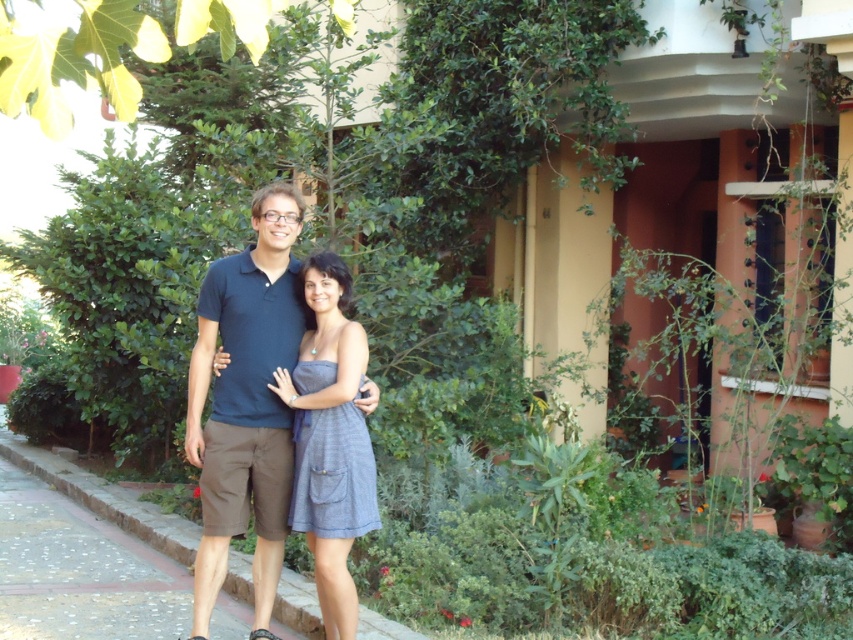
Question: Is dark blue cotton shirt at center to the left of gray woven dress at center from the viewer's perspective?

Choices:
 (A) no
 (B) yes

Answer: (B)

Question: Is dark blue cotton shirt at center above gray woven dress at center?

Choices:
 (A) no
 (B) yes

Answer: (B)

Question: Is dark blue cotton shirt at center wider than gray woven dress at center?

Choices:
 (A) yes
 (B) no

Answer: (A)

Question: Which point is closer to the camera taking this photo?

Choices:
 (A) (202, 476)
 (B) (323, 586)

Answer: (B)